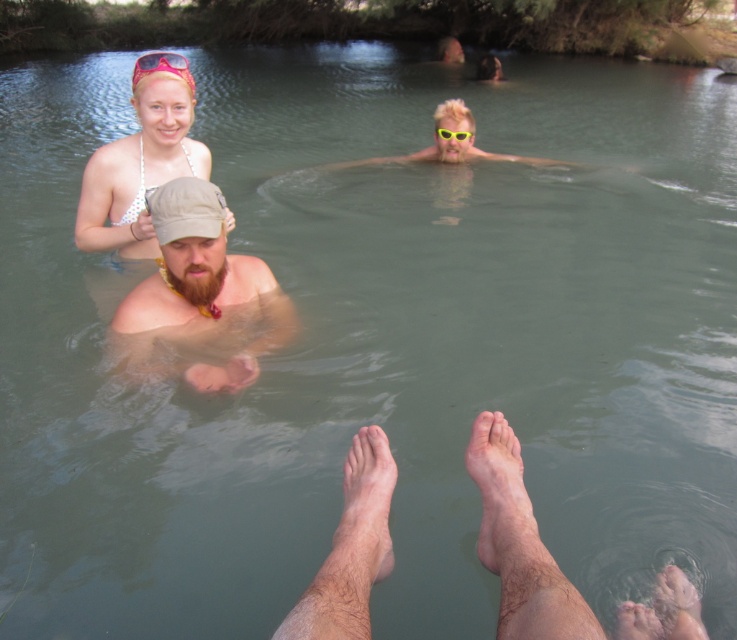
Who is more forward, (136, 67) or (450, 131)?

Point (136, 67) is in front.

Which is behind, point (181, 54) or point (453, 131)?

The point (181, 54) is more distant.

You are a GUI agent. You are given a task and a screenshot of the screen. Output one action in this format:
    pyautogui.click(x=<x>, y=<y>)
    Task: Click on the translucent pink sunglasses at upper center
    The height and width of the screenshot is (640, 737).
    Given the screenshot: What is the action you would take?
    point(160,61)

Between dry skin foot at lower center and pink plastic goggles at upper center, which one appears on the right side from the viewer's perspective?

From the viewer's perspective, dry skin foot at lower center appears more on the right side.

Can you confirm if dry skin foot at lower center is shorter than pink plastic goggles at upper center?

No.

Describe the element at coordinates (363, 516) in the screenshot. I see `dry skin foot at lower center` at that location.

Locate an element on the screen. dry skin foot at lower center is located at coordinates (363, 516).

Which is behind, point (184, 211) or point (447, 131)?

Positioned behind is point (447, 131).

Is brown fabric cap at center to the right of yellow plastic goggles at upper center from the viewer's perspective?

No, brown fabric cap at center is not to the right of yellow plastic goggles at upper center.

Who is more distant from viewer, (133,298) or (467,132)?

Positioned behind is point (467,132).

The image size is (737, 640). What are the coordinates of `brown fabric cap at center` in the screenshot? It's located at (203, 284).